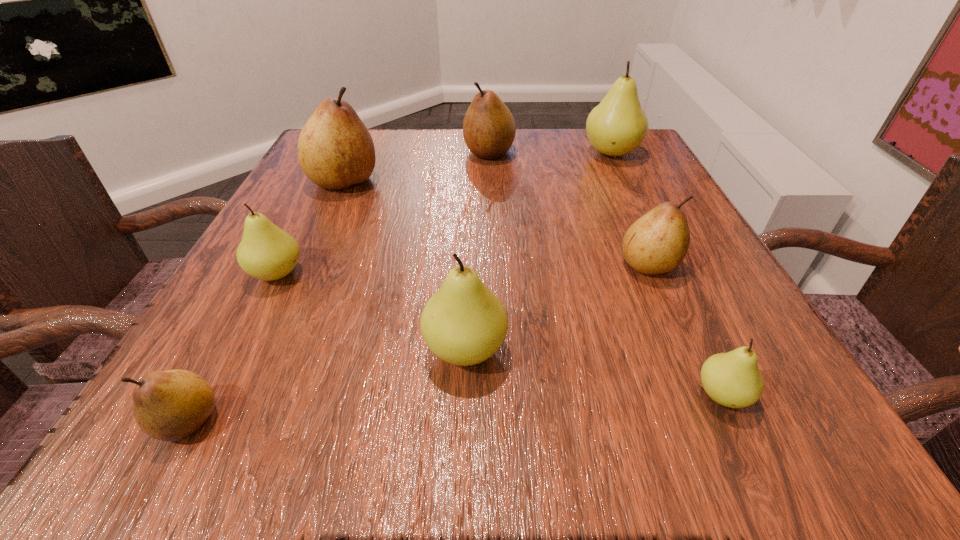
The image size is (960, 540). Identify the location of object at the far right corner. (618, 125).

Locate an element on the screen. The image size is (960, 540). object located in the near right corner section of the desktop is located at coordinates coord(733,379).

At what (x,y) coordinates should I click in order to perform the action: click on vacant space at the far edge. Please return your answer as a coordinate pair (x, y). This screenshot has width=960, height=540. Looking at the image, I should click on (448, 166).

Image resolution: width=960 pixels, height=540 pixels. In the image, there is a desktop. What are the coordinates of `vacant space at the left edge` in the screenshot? It's located at (302, 261).

Identify the location of free region at the right edge of the desktop. (773, 372).

In order to click on vacant region at the near right corner of the desktop in this screenshot , I will do `click(804, 389)`.

This screenshot has width=960, height=540. What are the coordinates of `unoccupied area between the nearest brown pear and the farthest green pear` in the screenshot? It's located at (399, 287).

What are the coordinates of `free space that is in between the nearest brown pear and the third smallest green pear` in the screenshot? It's located at (326, 385).

The height and width of the screenshot is (540, 960). What are the coordinates of `empty space that is in between the biggest brown pear and the smallest green pear` in the screenshot? It's located at (533, 288).

Locate an element on the screen. This screenshot has height=540, width=960. free space between the biggest brown pear and the second brown pear from right to left is located at coordinates (417, 167).